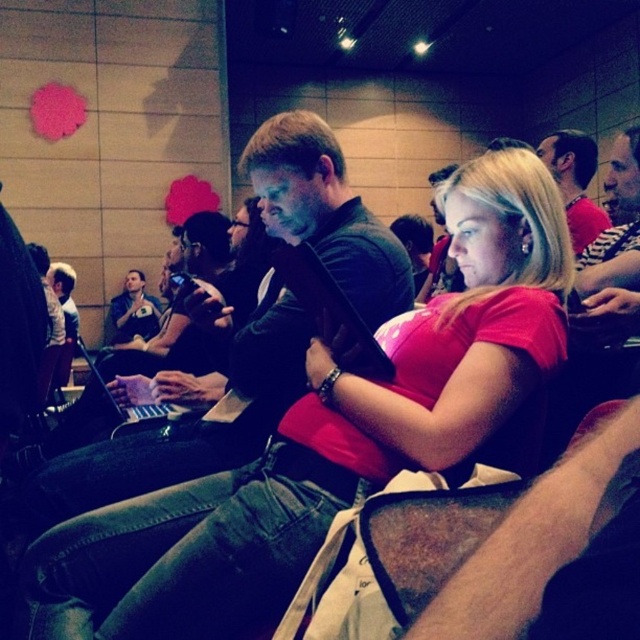
Who is more forward, (486, 300) or (157, 305)?

Point (486, 300) is more forward.

Is point (262, 598) more distant than point (136, 305)?

No, (262, 598) is closer to viewer.

Image resolution: width=640 pixels, height=640 pixels. I want to click on matte pink shirt at center, so click(336, 436).

Can you confirm if striped shirt at upper right is shorter than matte black laptop at left?

Yes.

The image size is (640, 640). Identify the location of striped shirt at upper right. (616, 227).

This screenshot has width=640, height=640. Describe the element at coordinates (616, 227) in the screenshot. I see `striped shirt at upper right` at that location.

The image size is (640, 640). I want to click on striped shirt at upper right, so click(x=616, y=227).

Can you confirm if matte pink shirt at center is positioned to the left of matte black shirt at center?

Yes, matte pink shirt at center is to the left of matte black shirt at center.

Does point (248, 464) lie in front of point (586, 234)?

Yes, point (248, 464) is in front of point (586, 234).

Find the location of `matte pink shirt at center`. matte pink shirt at center is located at coordinates (336, 436).

Find the location of a particular element. matte pink shirt at center is located at coordinates (336, 436).